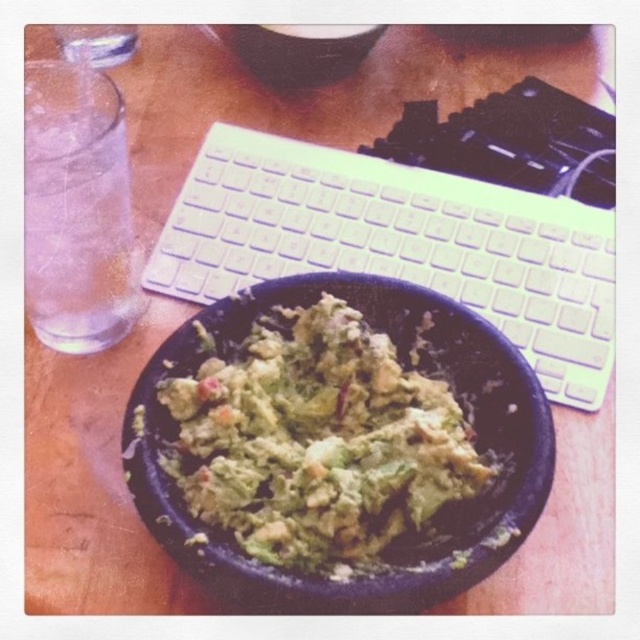
Between green matte guacamole at center and clear glass water at left, which one has less height?

With less height is green matte guacamole at center.

Is green matte guacamole at center wider than clear glass water at left?

Yes, green matte guacamole at center is wider than clear glass water at left.

Is point (256, 368) farther from viewer compared to point (83, 284)?

No, (256, 368) is in front of (83, 284).

Locate an element on the screen. This screenshot has width=640, height=640. green matte guacamole at center is located at coordinates (320, 440).

Is point (609, 355) in front of point (326, 380)?

No.

Who is more distant from viewer, (x=548, y=396) or (x=323, y=508)?

The point (x=548, y=396) is behind.

Which is behind, point (413, 177) or point (397, 392)?

Positioned behind is point (413, 177).

This screenshot has height=640, width=640. What are the coordinates of `white plastic keyboard at center` in the screenshot? It's located at (397, 244).

The height and width of the screenshot is (640, 640). What do you see at coordinates (397, 244) in the screenshot? I see `white plastic keyboard at center` at bounding box center [397, 244].

Is the position of white plastic keyboard at center more distant than that of clear glass water at left?

Yes, white plastic keyboard at center is further from the viewer.

The image size is (640, 640). Find the location of `white plastic keyboard at center`. white plastic keyboard at center is located at coordinates (397, 244).

Find the location of a particular element. white plastic keyboard at center is located at coordinates (397, 244).